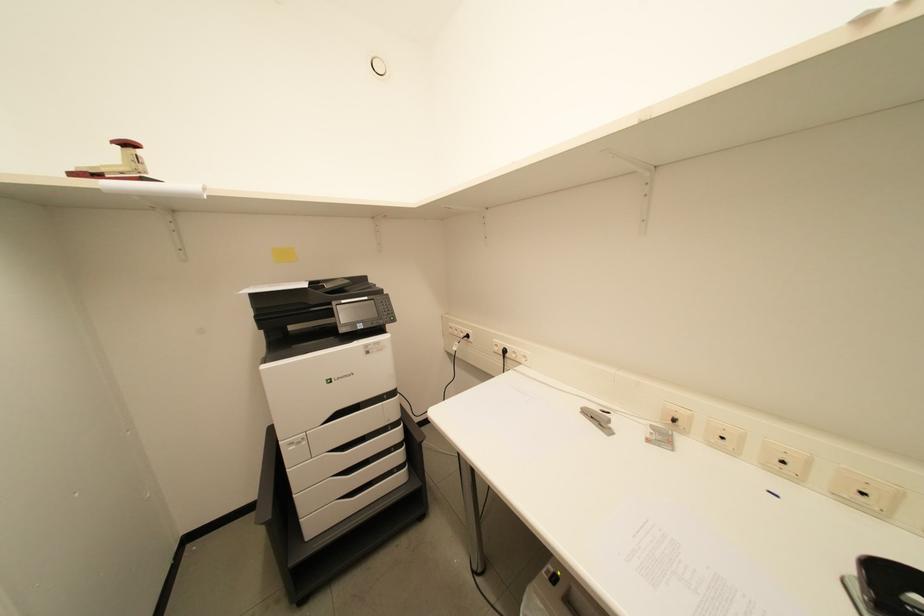
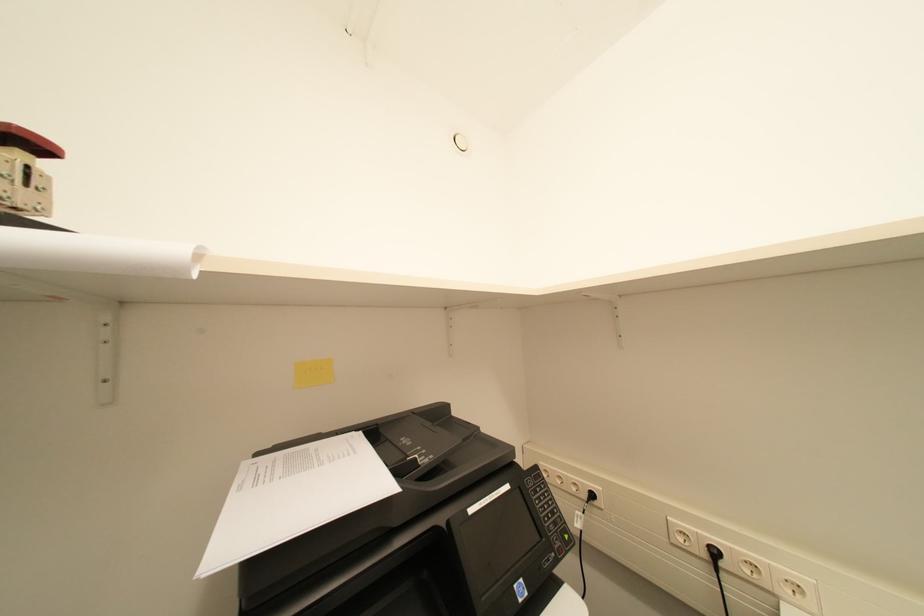
Question: Based on the continuous images, in which direction is the camera rotating? Reply with the corresponding letter.

Choices:
 (A) Left
 (B) Right
 (C) Up
 (D) Down

Answer: (C)